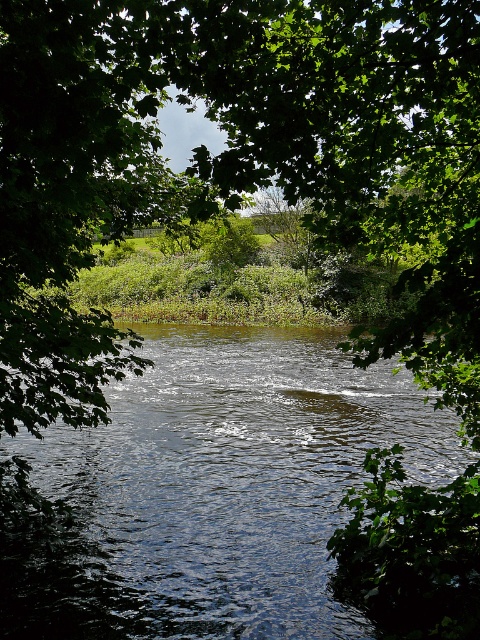
Who is more distant from viewer, [282,154] or [248,500]?

Point [248,500]

I want to click on green leafy tree at center, so click(231, 161).

What do you see at coordinates (231, 161) in the screenshot? The height and width of the screenshot is (640, 480). I see `green leafy tree at center` at bounding box center [231, 161].

You are a GUI agent. You are given a task and a screenshot of the screen. Output one action in this format:
    pyautogui.click(x=<x>, y=<y>)
    Task: Click on the green leafy tree at center
    
    Given the screenshot: What is the action you would take?
    pyautogui.click(x=231, y=161)